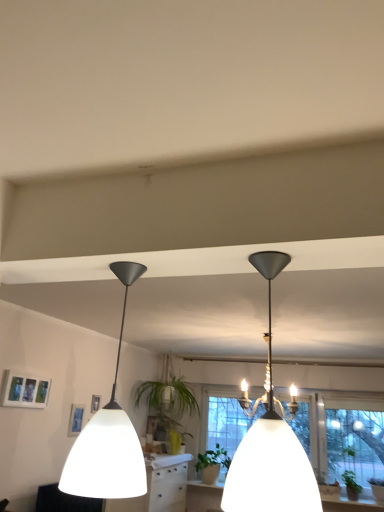
Question: From a real-world perspective, is green matte plant at center, the 2th plant from the right, located higher than matte black lampshade at left, the first lamp when ordered from left to right?

Choices:
 (A) yes
 (B) no

Answer: (B)

Question: From a real-world perspective, is green matte plant at center, arranged as the first plant when viewed from the back, physically below matte black lampshade at left, the 2th lamp in the right-to-left sequence?

Choices:
 (A) no
 (B) yes

Answer: (B)

Question: Is green matte plant at center, the 2th plant from the right, oriented towards matte black lampshade at left, the first lamp when ordered from left to right?

Choices:
 (A) yes
 (B) no

Answer: (A)

Question: Is the depth of green matte plant at center, marked as the 2th plant in a front-to-back arrangement, greater than that of matte black lampshade at left, the 2th lamp in the right-to-left sequence?

Choices:
 (A) yes
 (B) no

Answer: (A)

Question: Is matte black lampshade at left, the 2th lamp in the right-to-left sequence, surrounded by green matte plant at center, arranged as the first plant when viewed from the back?

Choices:
 (A) no
 (B) yes

Answer: (A)

Question: From the image's perspective, is green leafy plant at center located above or below matte white picture frame at upper left?

Choices:
 (A) below
 (B) above

Answer: (A)

Question: In terms of height, does green leafy plant at center look taller or shorter compared to matte white picture frame at upper left?

Choices:
 (A) short
 (B) tall

Answer: (B)

Question: Is green leafy plant at center wider or thinner than matte white picture frame at upper left?

Choices:
 (A) thin
 (B) wide

Answer: (B)

Question: From a real-world perspective, is green leafy plant at center above or below matte white picture frame at upper left?

Choices:
 (A) below
 (B) above

Answer: (A)

Question: Is green matte plant at lower right, the 2th plant positioned from the back, to the left or to the right of transparent glass window at center in the image?

Choices:
 (A) left
 (B) right

Answer: (B)

Question: From a real-world perspective, relative to transparent glass window at center, is green matte plant at lower right, the 2th plant positioned from the back, vertically above or below?

Choices:
 (A) below
 (B) above

Answer: (A)

Question: Is point (347, 490) closer or farther from the camera than point (355, 439)?

Choices:
 (A) farther
 (B) closer

Answer: (B)

Question: Is green matte plant at lower right, which is counted as the first plant, starting from the right, taller or shorter than transparent glass window at center?

Choices:
 (A) short
 (B) tall

Answer: (A)

Question: From the image's perspective, is matte black chandelier at upper center, the 1th lamp positioned from the right, positioned above or below matte black lampshade at left, the first lamp when ordered from left to right?

Choices:
 (A) above
 (B) below

Answer: (A)

Question: Is matte black chandelier at upper center, the 1th lamp positioned from the right, inside the boundaries of matte black lampshade at left, the 2th lamp in the right-to-left sequence, or outside?

Choices:
 (A) outside
 (B) inside

Answer: (A)